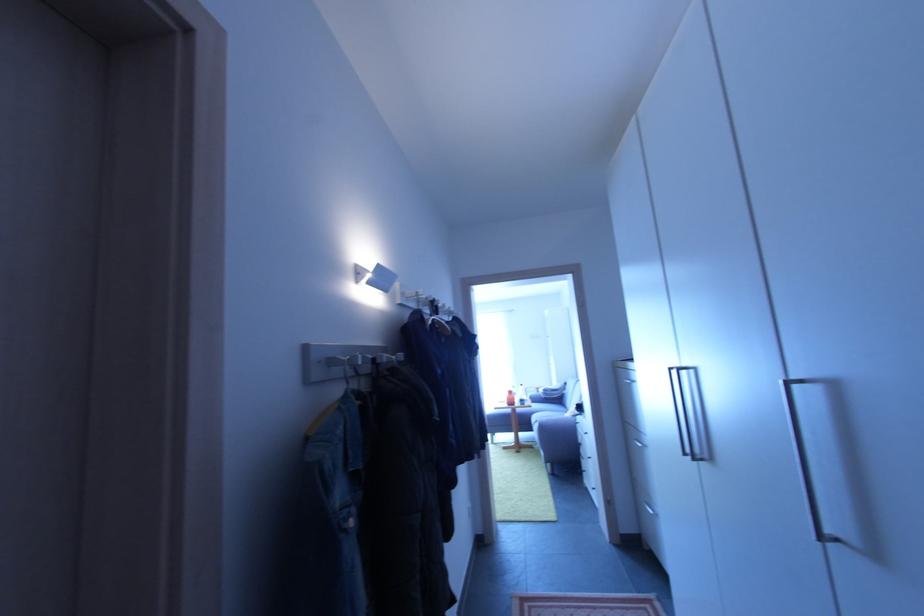
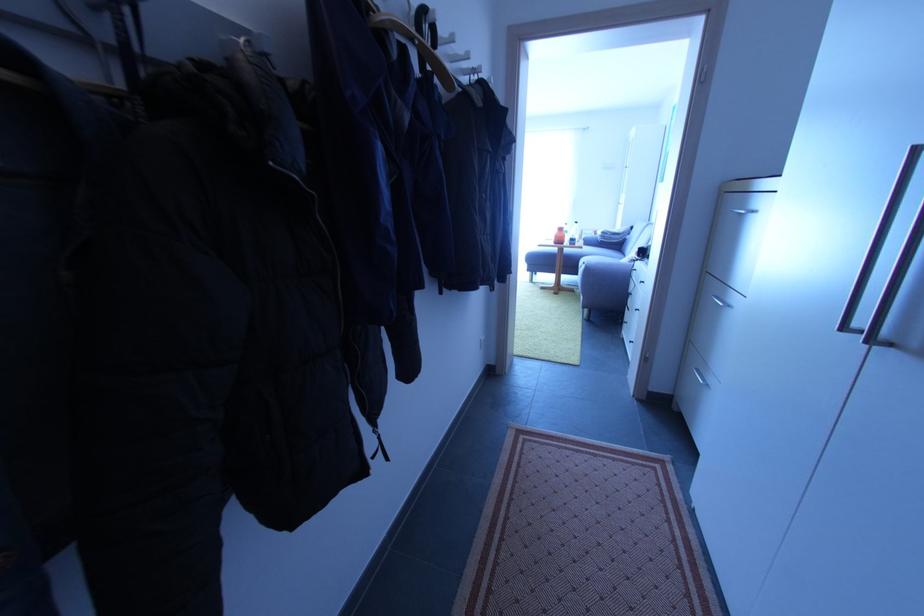
Question: I am providing you with two images of the same scene from different viewpoints. Which of the following objects are not visible in image2?

Choices:
 (A) orange bottle
 (B) white coat hook
 (C) sofa sitting surface
 (D) none of these

Answer: (D)